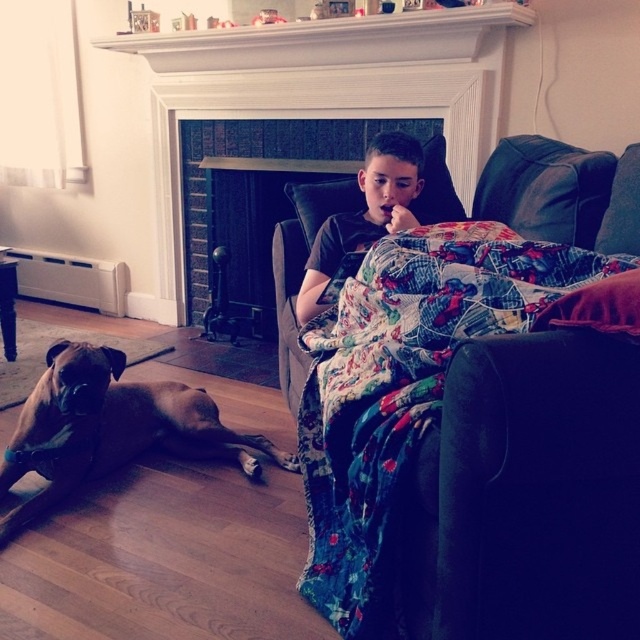
Question: Among these objects, which one is nearest to the camera?

Choices:
 (A) brick fireplace at center
 (B) black cotton shirt at center
 (C) floral cotton quilt at upper right

Answer: (C)

Question: Which point is closer to the camera taking this photo?

Choices:
 (A) (19, 448)
 (B) (412, 326)
 (C) (413, 216)

Answer: (B)

Question: Among these points, which one is farthest from the camera?

Choices:
 (A) (17, 426)
 (B) (188, 108)
 (C) (392, 134)

Answer: (B)

Question: Does floral cotton quilt at upper right appear on the right side of black cotton shirt at center?

Choices:
 (A) no
 (B) yes

Answer: (B)

Question: Is brick fireplace at center to the right of brown smooth dog at left from the viewer's perspective?

Choices:
 (A) yes
 (B) no

Answer: (A)

Question: Is brick fireplace at center closer to the viewer compared to black cotton shirt at center?

Choices:
 (A) yes
 (B) no

Answer: (B)